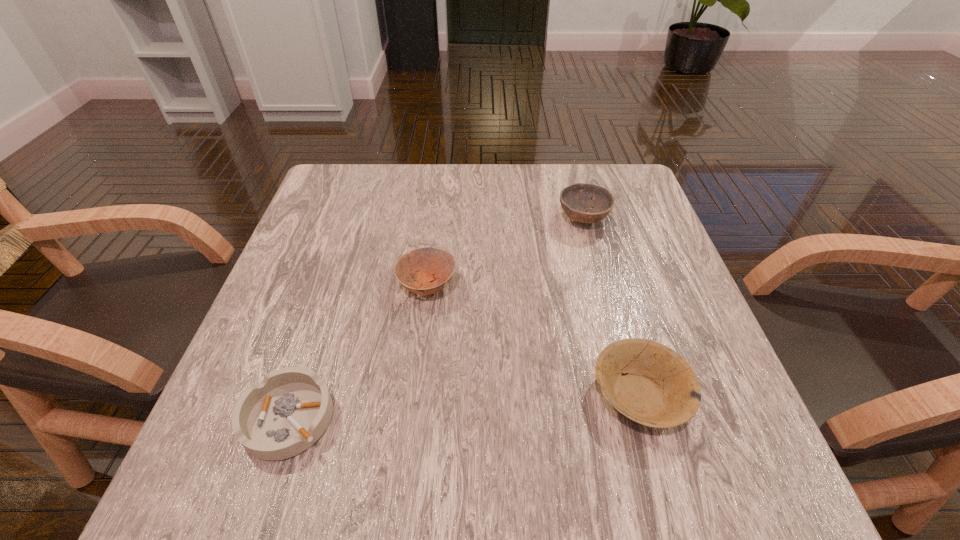
You are a GUI agent. You are given a task and a screenshot of the screen. Output one action in this format:
    pyautogui.click(x=<x>, y=<y>)
    Task: Click on the object present at the far edge
    
    Given the screenshot: What is the action you would take?
    pyautogui.click(x=576, y=199)

I want to click on bowl that is at the near edge, so click(x=658, y=388).

Find the location of `ashtray that is positioned at the near edge`. ashtray that is positioned at the near edge is located at coordinates (285, 414).

Locate an element on the screen. object that is positioned at the left edge is located at coordinates (285, 414).

Where is `object located in the near left corner section of the desktop`? Image resolution: width=960 pixels, height=540 pixels. object located in the near left corner section of the desktop is located at coordinates tap(285, 414).

This screenshot has height=540, width=960. Identify the location of object that is at the far right corner. (576, 199).

I want to click on object that is positioned at the near right corner, so click(658, 388).

In the image, there is a desktop. Identify the location of vacant space at the far edge. (462, 193).

In the image, there is a desktop. Identify the location of vacant space at the near edge. This screenshot has height=540, width=960. (416, 448).

Image resolution: width=960 pixels, height=540 pixels. In order to click on vacant space at the left edge of the desktop in this screenshot , I will do `click(337, 271)`.